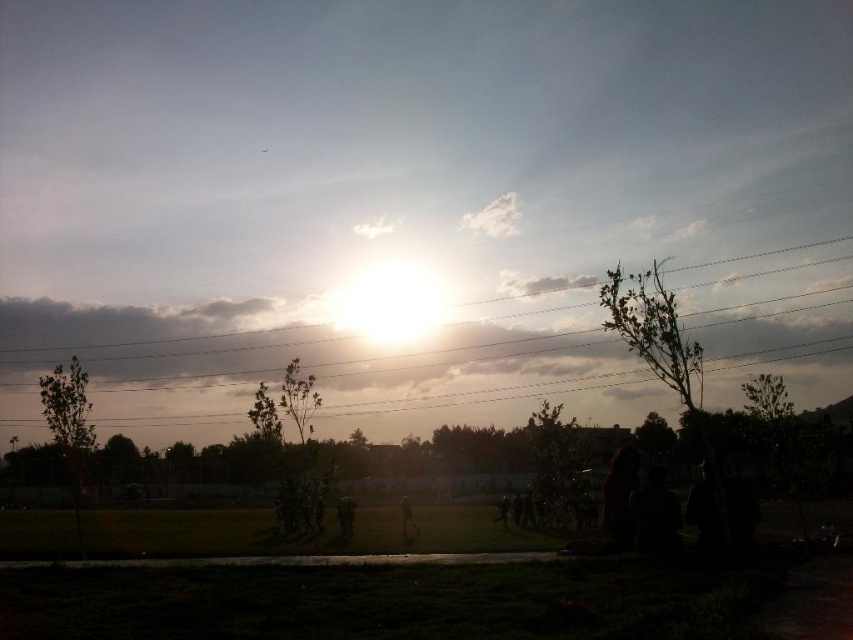
You are standing in the field and want to take a photo of the green leafy tree at center without the metallic wires at upper center appearing in the frame. Is it possible to do so by moving closer to the tree?

The metallic wires at upper center are taller than the green leafy tree at center. Moving closer to the tree might bring the wires into the frame more prominently, so it might not be possible to exclude them entirely.

You are a photographer wanting to capture a photo of the green leafy tree at center without the metallic wires at upper center appearing in the frame. Based on their positions, which direction should you move your camera to achieve this?

The metallic wires at upper center are to the left of the green leafy tree at center. To avoid the wires, move your camera to the right so that the tree is centered and the wires are no longer in the frame.